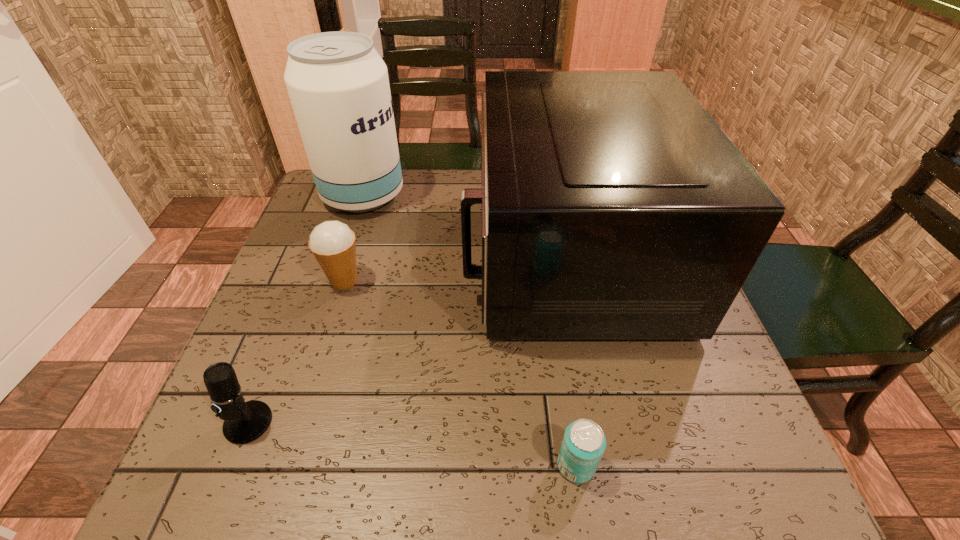
At what (x,y) coordinates should I click in order to perform the action: click on vacant space situated 0.270m on the front of the icecream. Please return your answer as a coordinate pair (x, y). The width and height of the screenshot is (960, 540). Looking at the image, I should click on (303, 414).

What are the coordinates of `vacant position located on the right of the fourth farthest object` in the screenshot? It's located at (337, 422).

What are the coordinates of `free point located 0.240m on the back of the shortest object` in the screenshot? It's located at (555, 329).

At what (x,y) coordinates should I click in order to perform the action: click on alcohol positioned at the far edge. Please return your answer as a coordinate pair (x, y). Image resolution: width=960 pixels, height=540 pixels. Looking at the image, I should click on click(338, 84).

Locate an element on the screen. Image resolution: width=960 pixels, height=540 pixels. microwave_oven present at the far edge is located at coordinates (613, 206).

The height and width of the screenshot is (540, 960). What are the coordinates of `microphone located in the near edge section of the desktop` in the screenshot? It's located at (244, 422).

Find the location of a particular element. The image size is (960, 540). beer can at the near edge is located at coordinates (583, 444).

Where is `alcohol that is positioned at the left edge`? alcohol that is positioned at the left edge is located at coordinates (338, 84).

At what (x,y) coordinates should I click in order to perform the action: click on icecream present at the left edge. Please return your answer as a coordinate pair (x, y). The height and width of the screenshot is (540, 960). Looking at the image, I should click on (332, 243).

Locate an element on the screen. This screenshot has height=540, width=960. microphone located at the left edge is located at coordinates (244, 422).